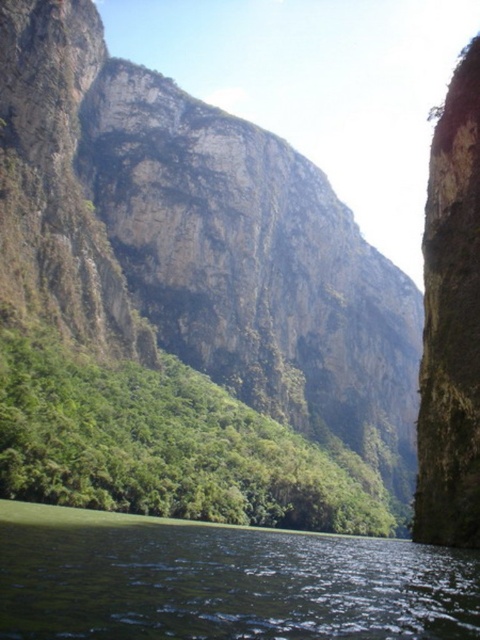
You are a hiker standing at the base of the cliffs and want to take a photo of the rough stone mountain at center and the green leafy vegetation at center. Which object should you position to your left side in the camera frame?

You should position the green leafy vegetation at center to your left side in the camera frame because the rough stone mountain at center is to the right of the green leafy vegetation at center.

From the picture: You are standing at the base of the cliffs in the image. A red marker has been placed at point (x=56, y=508). Can you estimate how far this marker is from your current position?

The point (x=56, y=508) is 80.33 meters away from the viewer, so the marker is approximately 80.33 meters away from your current position.

You are planning to paint this landscape scene. Which object from the image should you focus on painting first if you want to cover the larger area? Please choose between the green smooth water at lower center and the green leafy vegetation at center.

The green leafy vegetation at center occupies a larger area than the green smooth water at lower center, so you should focus on painting the green leafy vegetation at center first to cover the bigger space.